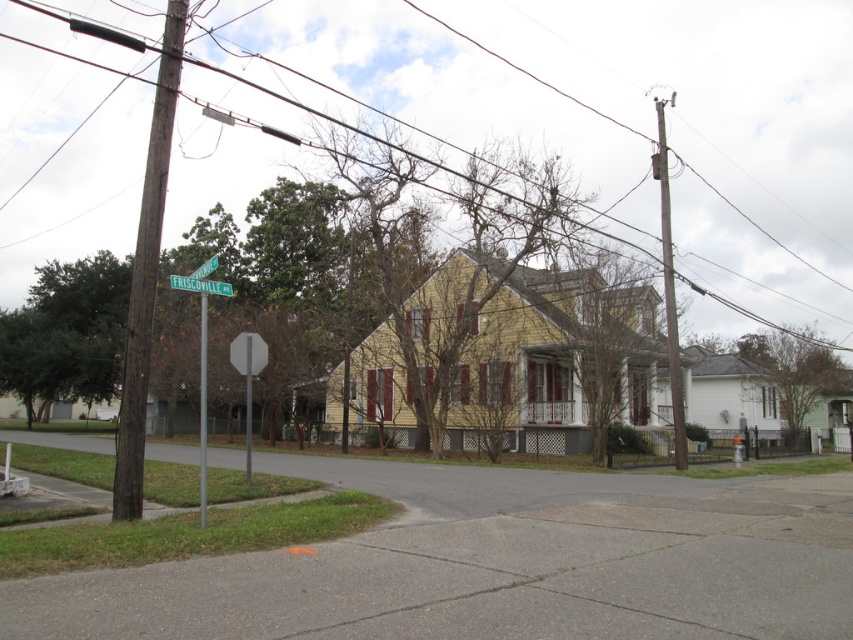
Question: Is brown wooden utility pole at right below metallic pole at left?

Choices:
 (A) yes
 (B) no

Answer: (B)

Question: Which object appears farthest from the camera in this image?

Choices:
 (A) brown wooden utility pole at right
 (B) smooth wire at upper center

Answer: (B)

Question: Among these objects, which one is nearest to the camera?

Choices:
 (A) smooth wire at upper center
 (B) metallic pole at left

Answer: (B)

Question: Which point appears farthest from the camera in this image?

Choices:
 (A) (204, 461)
 (B) (200, 285)
 (C) (666, 316)
 (D) (201, 321)

Answer: (C)

Question: Considering the relative positions of brown wooden pole at left and green plastic street sign at upper center in the image provided, where is brown wooden pole at left located with respect to green plastic street sign at upper center?

Choices:
 (A) right
 (B) left

Answer: (B)

Question: Can you confirm if smooth wire at upper center is thinner than brown wooden utility pole at right?

Choices:
 (A) no
 (B) yes

Answer: (A)